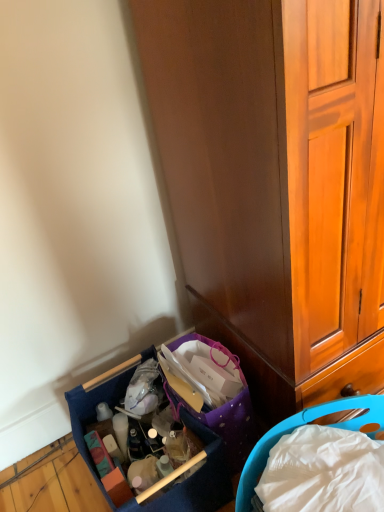
Question: From a real-world perspective, is blue fabric basket at lower left, the 1th picnic basket positioned from the left, located beneath wooden cabinet at lower right?

Choices:
 (A) yes
 (B) no

Answer: (A)

Question: Considering the relative positions of blue fabric basket at lower left, the 1th picnic basket positioned from the left, and wooden cabinet at lower right in the image provided, is blue fabric basket at lower left, the 1th picnic basket positioned from the left, to the left of wooden cabinet at lower right from the viewer's perspective?

Choices:
 (A) yes
 (B) no

Answer: (A)

Question: Are blue fabric basket at lower left, the 1th picnic basket positioned from the left, and wooden cabinet at lower right far apart?

Choices:
 (A) no
 (B) yes

Answer: (A)

Question: Does blue fabric basket at lower left, the second picnic basket positioned from the right, lie in front of wooden cabinet at lower right?

Choices:
 (A) yes
 (B) no

Answer: (B)

Question: Considering the relative sizes of blue fabric basket at lower left, the 1th picnic basket positioned from the left, and wooden cabinet at lower right in the image provided, is blue fabric basket at lower left, the 1th picnic basket positioned from the left, thinner than wooden cabinet at lower right?

Choices:
 (A) yes
 (B) no

Answer: (A)

Question: From the image's perspective, would you say blue fabric basket at lower left, the 1th picnic basket positioned from the left, is positioned over wooden cabinet at lower right?

Choices:
 (A) no
 (B) yes

Answer: (A)

Question: Is blue plastic picnic basket at lower right, which is counted as the 1th picnic basket, starting from the right, not near blue fabric basket at lower left, the second picnic basket positioned from the right?

Choices:
 (A) no
 (B) yes

Answer: (A)

Question: From the image's perspective, is blue plastic picnic basket at lower right, which is counted as the second picnic basket, starting from the left, over blue fabric basket at lower left, the second picnic basket positioned from the right?

Choices:
 (A) yes
 (B) no

Answer: (B)

Question: Is blue plastic picnic basket at lower right, which is counted as the second picnic basket, starting from the left, at the right side of blue fabric basket at lower left, the second picnic basket positioned from the right?

Choices:
 (A) no
 (B) yes

Answer: (B)

Question: Is blue plastic picnic basket at lower right, which is counted as the second picnic basket, starting from the left, wider than blue fabric basket at lower left, the 1th picnic basket positioned from the left?

Choices:
 (A) no
 (B) yes

Answer: (A)

Question: Does blue plastic picnic basket at lower right, which is counted as the 1th picnic basket, starting from the right, have a lesser height compared to blue fabric basket at lower left, the 1th picnic basket positioned from the left?

Choices:
 (A) no
 (B) yes

Answer: (B)

Question: Is blue plastic picnic basket at lower right, which is counted as the 1th picnic basket, starting from the right, oriented away from blue fabric basket at lower left, the second picnic basket positioned from the right?

Choices:
 (A) yes
 (B) no

Answer: (A)

Question: Considering the relative positions of wooden cabinet at lower right and blue fabric basket at lower left, the second picnic basket positioned from the right, in the image provided, is wooden cabinet at lower right to the left of blue fabric basket at lower left, the second picnic basket positioned from the right, from the viewer's perspective?

Choices:
 (A) yes
 (B) no

Answer: (B)